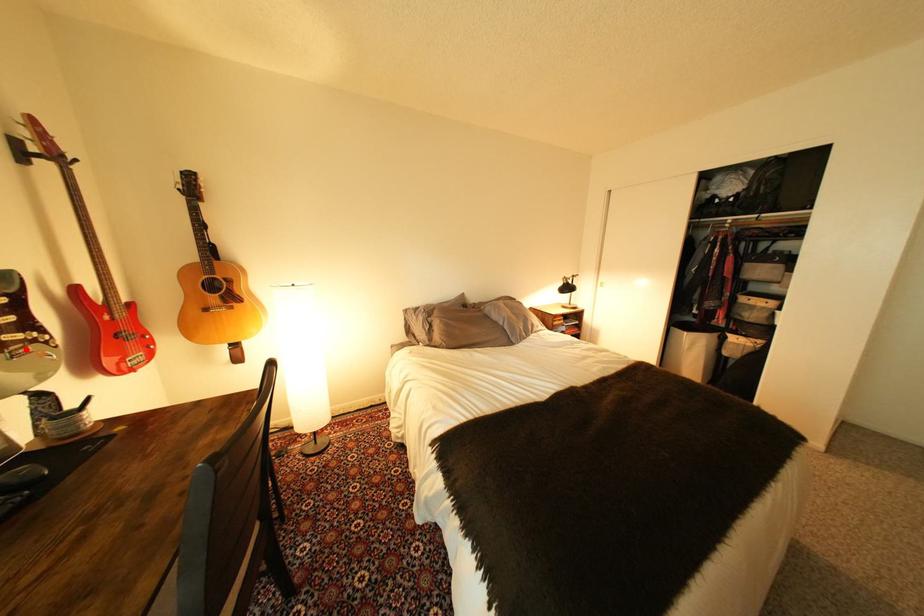
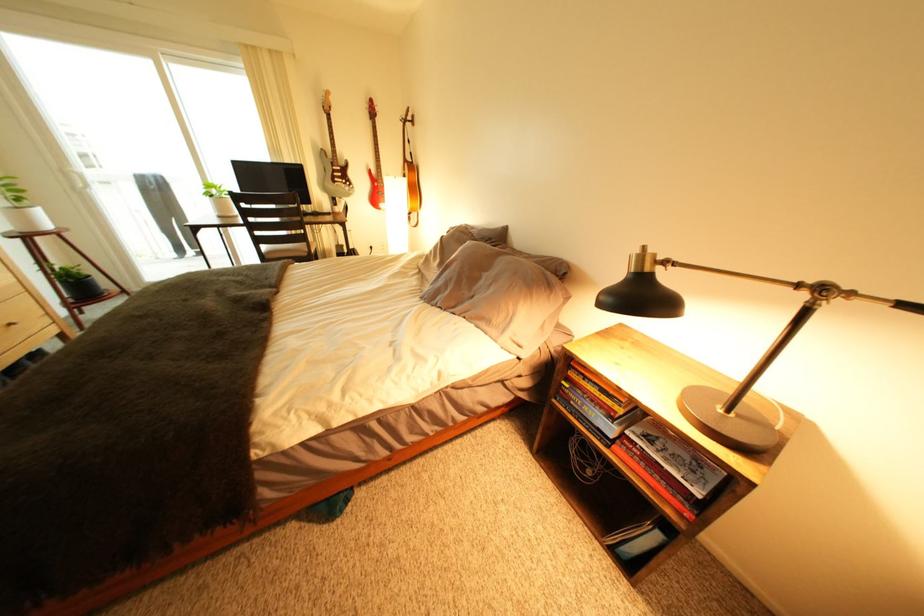
Question: I am providing you with two images of the same scene from different viewpoints. A red point is shown in image1. For the corresponding object point in image2, is it positioned nearer or farther from the camera?

Choices:
 (A) Nearer
 (B) Farther

Answer: (A)